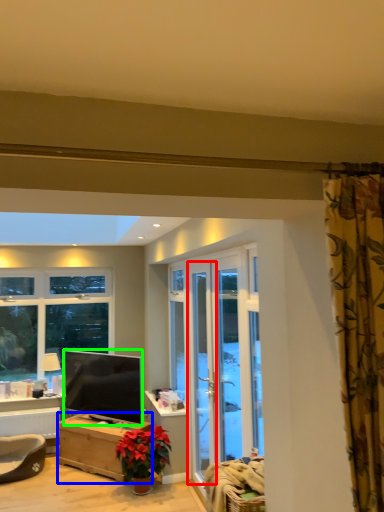
Question: Estimate the real-world distances between objects in this image. Which object is closer to screen door (highlighted by a red box), desk (highlighted by a blue box) or television (highlighted by a green box)?

Choices:
 (A) desk
 (B) television

Answer: (B)